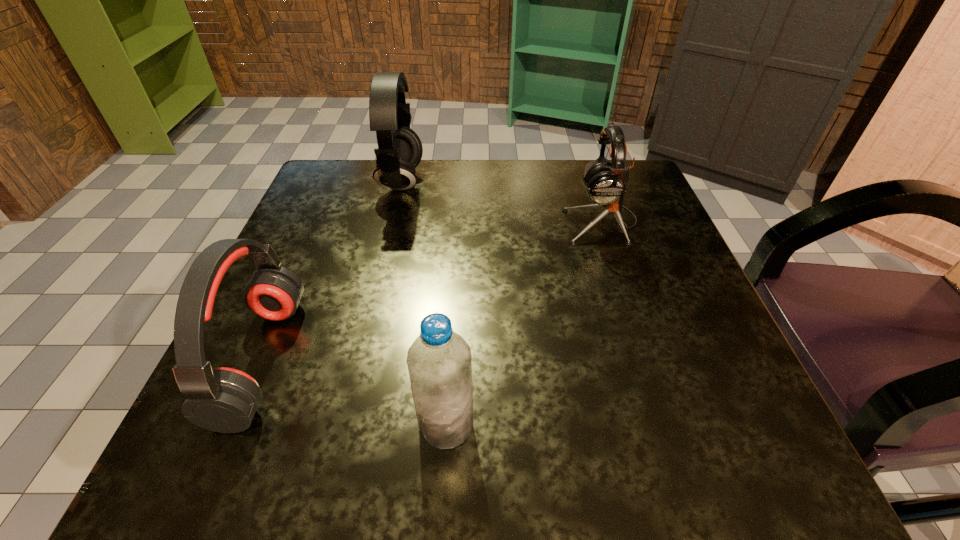
At what (x,y) coordinates should I click in order to perform the action: click on free space that satisfies the following two spatial constraints: 1. on the back side of the rightmost earphone; 2. on the ear cups of the second object from left to right. Please return your answer as a coordinate pair (x, y). Looking at the image, I should click on pos(588,183).

At what (x,y) coordinates should I click in order to perform the action: click on vacant position in the image that satisfies the following two spatial constraints: 1. on the ear cups of the second earphone from left to right; 2. on the right side of the rightmost object. Please return your answer as a coordinate pair (x, y). This screenshot has height=540, width=960. Looking at the image, I should click on (392, 222).

The width and height of the screenshot is (960, 540). Identify the location of free space in the image that satisfies the following two spatial constraints: 1. on the ear cups of the second earphone from left to right; 2. on the right side of the water bottle. (344, 424).

Find the location of a particular element. free spot that satisfies the following two spatial constraints: 1. on the ear cups of the leftmost earphone; 2. on the left side of the third object from left to right is located at coordinates (233, 424).

Where is `vacant space that satisfies the following two spatial constraints: 1. on the back side of the third object from left to right; 2. on the left side of the rightmost earphone`? vacant space that satisfies the following two spatial constraints: 1. on the back side of the third object from left to right; 2. on the left side of the rightmost earphone is located at coordinates (458, 222).

Locate an element on the screen. vacant space that satisfies the following two spatial constraints: 1. on the back side of the rightmost earphone; 2. on the ear cups of the second earphone from left to right is located at coordinates (588, 183).

Locate an element on the screen. vacant region that satisfies the following two spatial constraints: 1. on the back side of the water bottle; 2. on the ear cups of the leftmost object is located at coordinates (450, 360).

The height and width of the screenshot is (540, 960). In order to click on vacant point that satisfies the following two spatial constraints: 1. on the back side of the water bottle; 2. on the ear cups of the second earphone from left to right in this screenshot , I will do `click(461, 183)`.

Find the location of a particular element. free space that satisfies the following two spatial constraints: 1. on the front side of the rightmost earphone; 2. on the ear cups of the leftmost object is located at coordinates (646, 360).